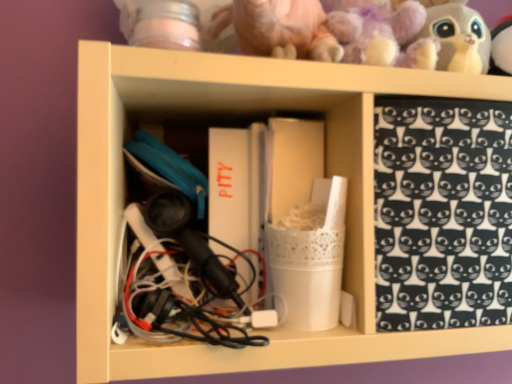
This screenshot has width=512, height=384. What do you see at coordinates (458, 37) in the screenshot? I see `white plush toy at upper right` at bounding box center [458, 37].

This screenshot has width=512, height=384. I want to click on white plush toy at upper right, so click(x=458, y=37).

Locate an element on the screen. white plush toy at upper right is located at coordinates (458, 37).